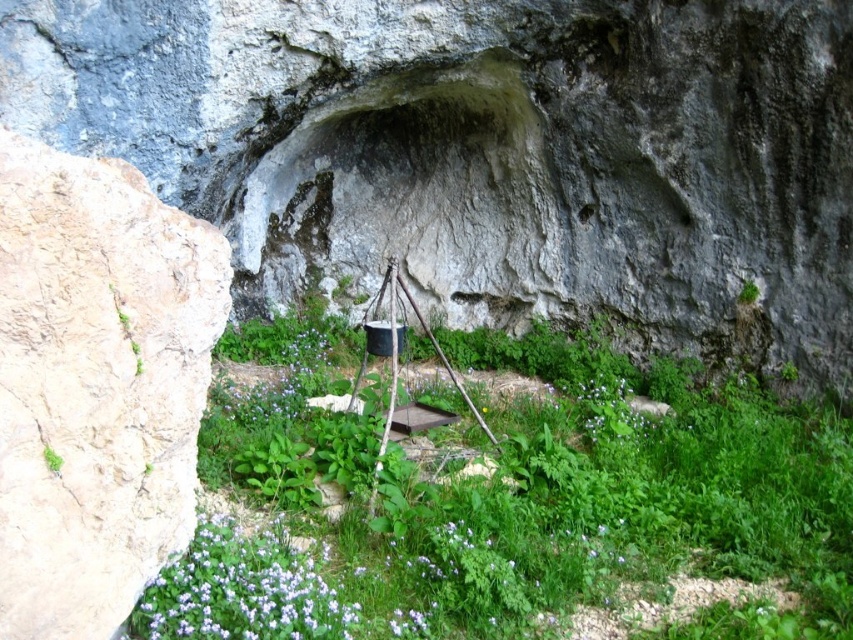
You are an explorer who needs to decide which purple matte flower to pick for your collection. Both the purple matte flower at lower left and the purple matte flower at center are in view. Which one is wider?

The purple matte flower at center is wider than the purple matte flower at lower left.